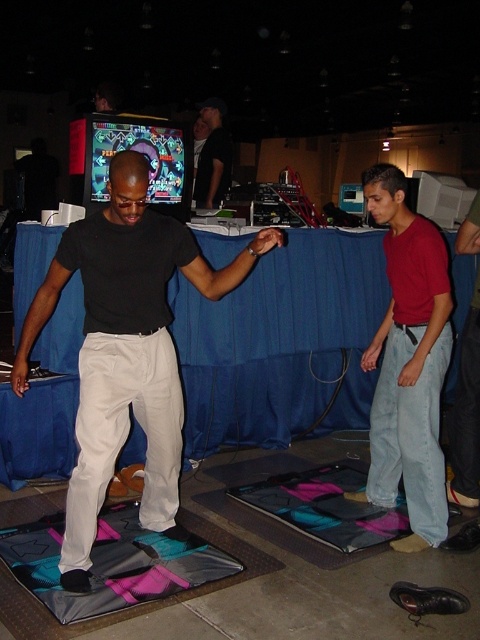
You are standing at the entrance of the event and want to play the shiny plastic arcade machine at center. Which direction should you walk to reach it?

The shiny plastic arcade machine at center is located at point (136, 150), so you should walk towards the center of the room to reach it.

You are at a gaming convention and see the matte black pants at center and the teal fabric yoga mat at lower center. Which object is taller?

The matte black pants at center is taller than the teal fabric yoga mat at lower center.